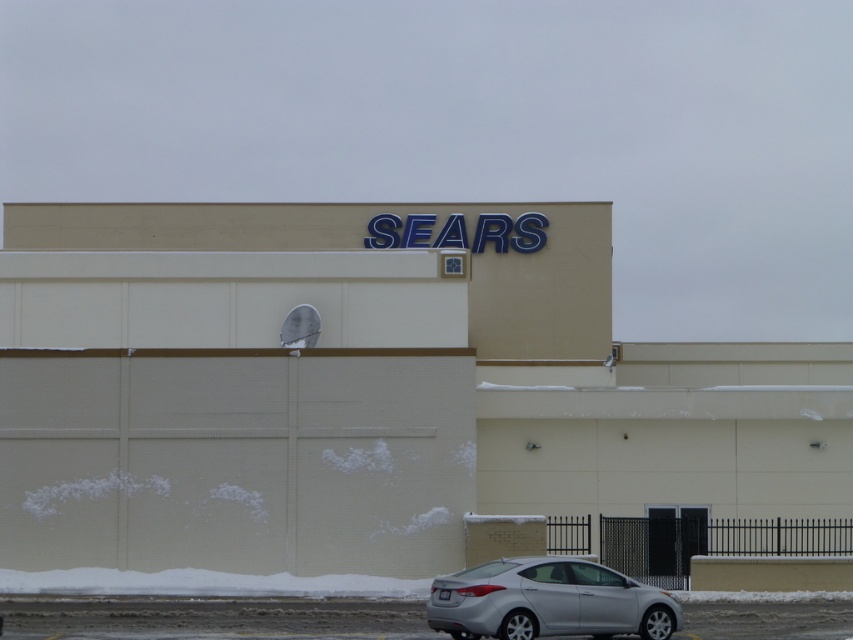
Between silver metallic car at lower center and silver metallic sedan at lower center, which one appears on the right side from the viewer's perspective?

Positioned to the right is silver metallic sedan at lower center.

Does silver metallic car at lower center come in front of silver metallic sedan at lower center?

No, it is not.

Does point (206, 618) lie behind point (563, 634)?

That is True.

The height and width of the screenshot is (640, 853). I want to click on silver metallic car at lower center, so click(x=212, y=618).

Does point (787, 376) come farther from viewer compared to point (473, 576)?

That is True.

You are a GUI agent. You are given a task and a screenshot of the screen. Output one action in this format:
    pyautogui.click(x=<x>, y=<y>)
    Task: Click on the beige/matte building at center
    The image size is (853, 640).
    Given the screenshot: What is the action you would take?
    pyautogui.click(x=376, y=396)

This screenshot has width=853, height=640. Find the location of `beige/matte building at center`. beige/matte building at center is located at coordinates (376, 396).

Can you confirm if beige/matte building at center is positioned to the left of silver metallic car at lower center?

Incorrect, beige/matte building at center is not on the left side of silver metallic car at lower center.

Can you confirm if beige/matte building at center is smaller than silver metallic car at lower center?

No.

Consider the image. Who is more distant from viewer, (107, 342) or (285, 614)?

Point (107, 342)

What are the coordinates of `beige/matte building at center` in the screenshot? It's located at (376, 396).